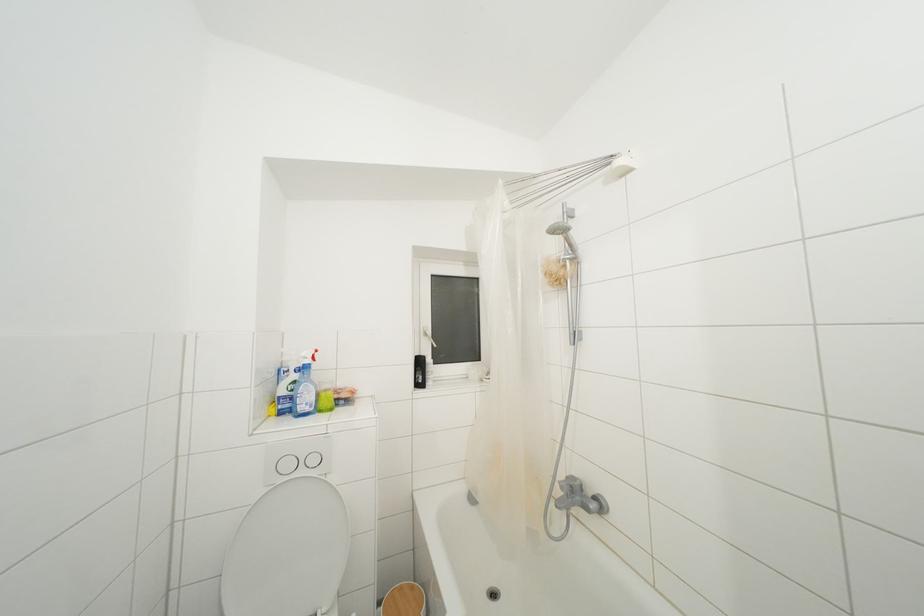
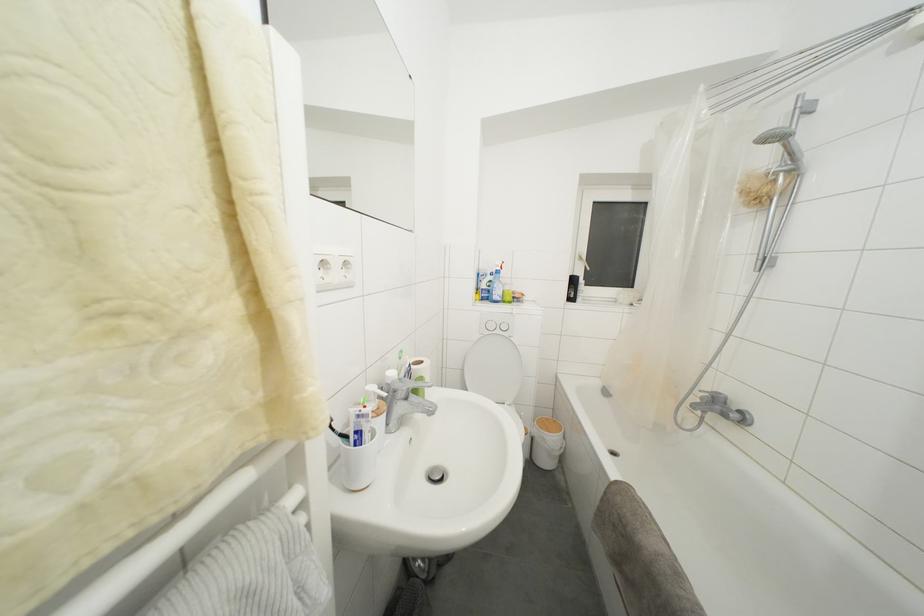
The point at (575,251) is marked in the first image. Where is the corresponding point in the second image?

(796, 159)